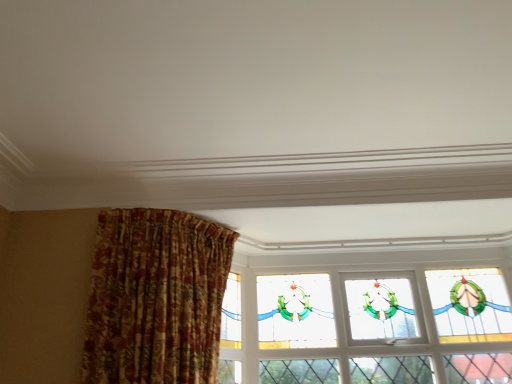
Question: Is stained glass window at upper center shorter than floral fabric curtain at left?

Choices:
 (A) no
 (B) yes

Answer: (A)

Question: From a real-world perspective, does stained glass window at upper center sit lower than floral fabric curtain at left?

Choices:
 (A) no
 (B) yes

Answer: (A)

Question: From a real-world perspective, is stained glass window at upper center over floral fabric curtain at left?

Choices:
 (A) yes
 (B) no

Answer: (A)

Question: Are stained glass window at upper center and floral fabric curtain at left located far from each other?

Choices:
 (A) yes
 (B) no

Answer: (B)

Question: From the image's perspective, would you say stained glass window at upper center is positioned over floral fabric curtain at left?

Choices:
 (A) yes
 (B) no

Answer: (B)

Question: Does stained glass window at upper center appear on the left side of floral fabric curtain at left?

Choices:
 (A) no
 (B) yes

Answer: (A)

Question: From the image's perspective, is floral fabric curtain at left beneath stained glass window at upper center?

Choices:
 (A) no
 (B) yes

Answer: (A)

Question: From a real-world perspective, is floral fabric curtain at left beneath stained glass window at upper center?

Choices:
 (A) no
 (B) yes

Answer: (B)

Question: Is floral fabric curtain at left closer to camera compared to stained glass window at upper center?

Choices:
 (A) yes
 (B) no

Answer: (A)

Question: Does floral fabric curtain at left appear on the left side of stained glass window at upper center?

Choices:
 (A) no
 (B) yes

Answer: (B)

Question: Would you say stained glass window at upper center is part of floral fabric curtain at left's contents?

Choices:
 (A) yes
 (B) no

Answer: (B)

Question: Is floral fabric curtain at left to the right of stained glass window at upper center from the viewer's perspective?

Choices:
 (A) no
 (B) yes

Answer: (A)

Question: Which is correct: stained glass window at upper center is inside floral fabric curtain at left, or outside of it?

Choices:
 (A) outside
 (B) inside

Answer: (A)